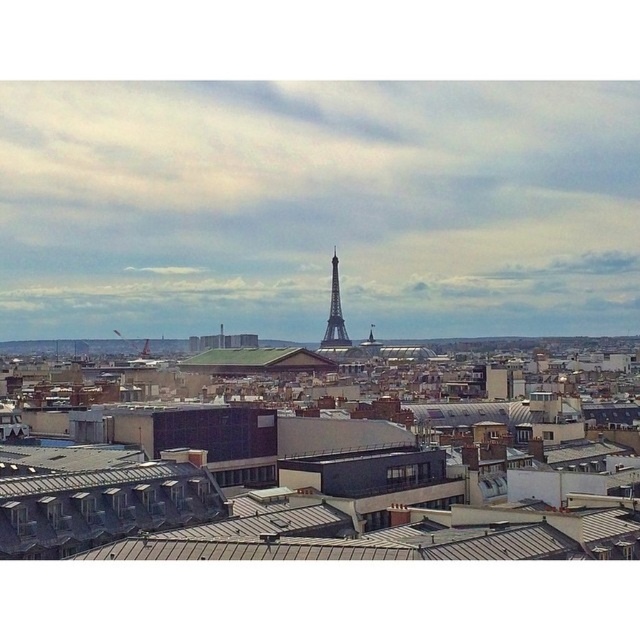
In the scene shown: You are an architect analyzing the cityscape. You need to determine which object is nearer to you between the gray metallic roof at center and the shiny metallic eiffel tower at center. Based on the scene, which one is closer?

The gray metallic roof at center is closer to the viewer than the shiny metallic eiffel tower at center.

You are a drone operator planning to fly a drone from the gray metallic roof at center to the shiny metallic eiffel tower at center. The drone has a maximum flight range of 400 meters. Based on the scene, will the drone be able to reach the eiffel tower without needing a recharge?

The distance between the gray metallic roof at center and the shiny metallic eiffel tower at center is 429.12 meters, which exceeds the drone maximum flight range of 400 meters. Therefore, the drone will not be able to reach the Eiffel Tower without needing a recharge.